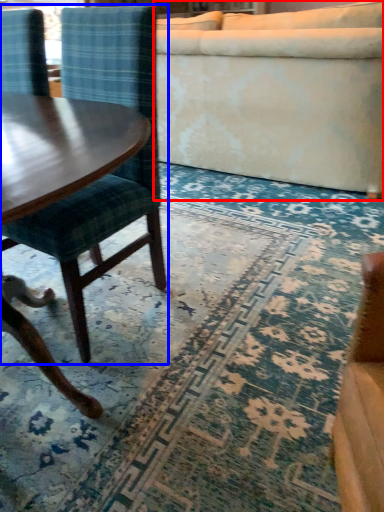
Question: Among these objects, which one is farthest to the camera, studio couch (highlighted by a red box) or chair (highlighted by a blue box)?

Choices:
 (A) studio couch
 (B) chair

Answer: (A)